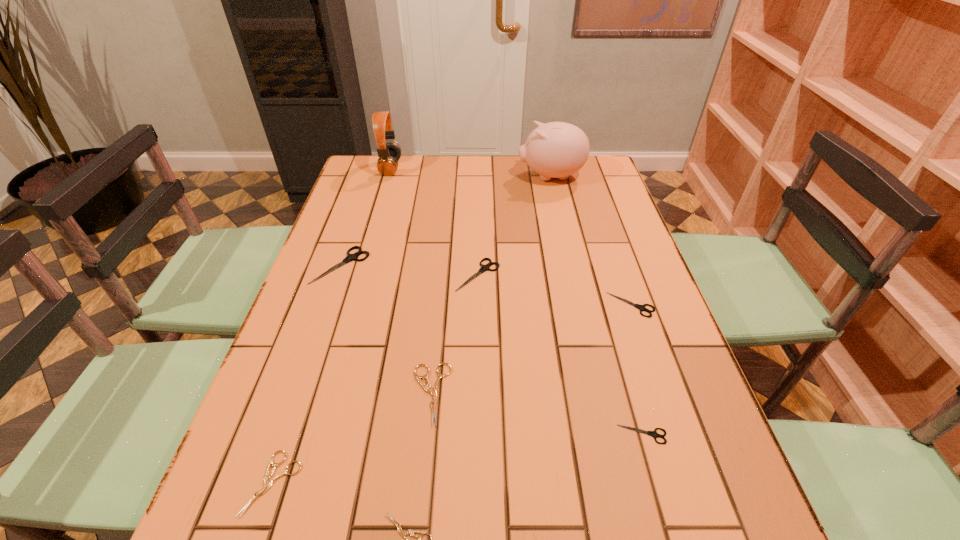
Find the location of a particular element. The image size is (960, 540). the nearest black shears is located at coordinates (654, 434).

I want to click on vacant space positioned on the ear cups of the brown headset, so click(x=445, y=167).

Find the location of a particular element. free spot located at the snout of the piggy bank is located at coordinates (483, 177).

At what (x,y) coordinates should I click in order to perform the action: click on free spot located 0.250m at the snout of the piggy bank. Please return your answer as a coordinate pair (x, y). This screenshot has width=960, height=540. Looking at the image, I should click on (445, 177).

The width and height of the screenshot is (960, 540). Find the location of `vacant point located 0.290m at the snout of the piggy bank`. vacant point located 0.290m at the snout of the piggy bank is located at coordinates (434, 177).

You are a GUI agent. You are given a task and a screenshot of the screen. Output one action in this format:
    pyautogui.click(x=<x>, y=<y>)
    Task: Click on the free spot located 0.390m on the right of the third tallest object
    
    Given the screenshot: What is the action you would take?
    pyautogui.click(x=511, y=265)

You are a GUI agent. You are given a task and a screenshot of the screen. Output one action in this format:
    pyautogui.click(x=<x>, y=<y>)
    Task: Click on the vacant space situated on the front of the second black shears from left to right
    
    Given the screenshot: What is the action you would take?
    pyautogui.click(x=477, y=362)

What are the coordinates of `free space located on the front of the second nearest black shears` in the screenshot? It's located at (682, 451).

Locate an element on the screen. free space located 0.230m on the back of the farthest beige shears is located at coordinates (441, 290).

At what (x,y) coordinates should I click in order to perform the action: click on free space located on the right of the second biggest beige shears. Please return your answer as a coordinate pair (x, y). Looking at the image, I should click on (337, 483).